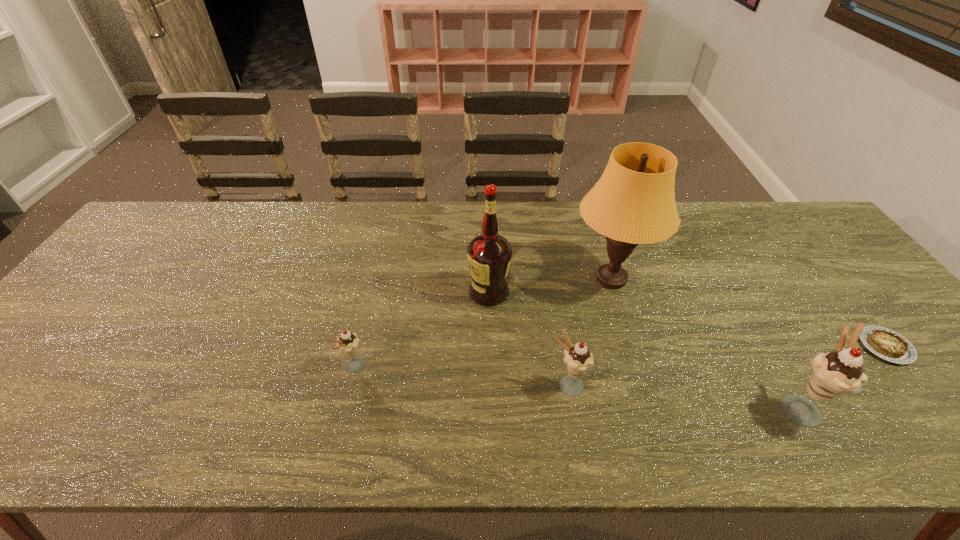
In the current image, all icecreams are evenly spaced. To maintain this equal spacing, where should an additional icecream be placed on the left? Please point out a free spot. Please provide its 2D coordinates. Your answer should be formatted as a tuple, i.e. [(x, y)], where the tuple contains the x and y coordinates of a point satisfying the conditions above.

[(156, 350)]